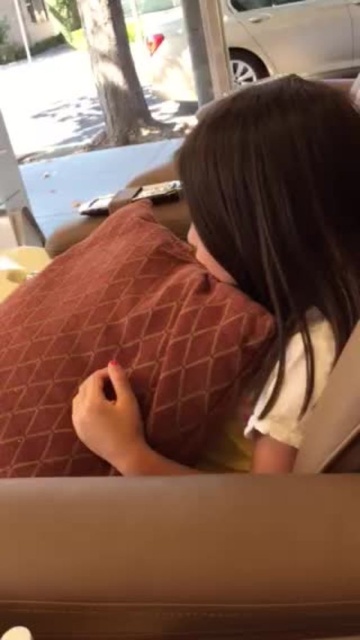
You are planning to take a nap on the couch where the matte brown pillow at center is placed. Considering the size of the silver metallic car at upper center, do you think the space between the couch and the car is sufficient for you to stretch your legs comfortably?

The matte brown pillow at center is smaller than the silver metallic car at upper center, but the description does not provide information about the distance between the couch and the car. Therefore, it is impossible to determine if the space is sufficient for stretching your legs.